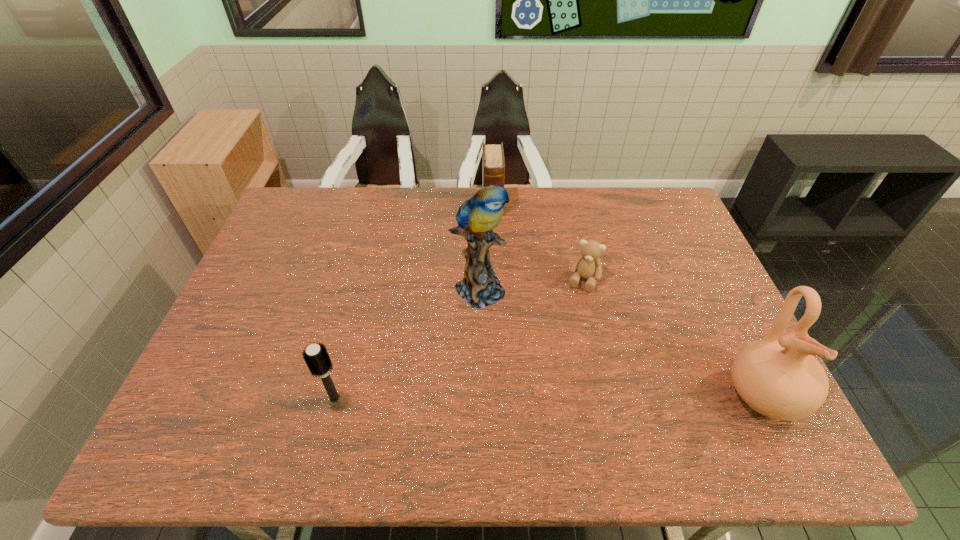
This screenshot has width=960, height=540. I want to click on object located in the right edge section of the desktop, so click(777, 376).

Where is `object that is at the near right corner`? object that is at the near right corner is located at coordinates (777, 376).

You are a GUI agent. You are given a task and a screenshot of the screen. Output one action in this format:
    pyautogui.click(x=<x>, y=<y>)
    Task: Click on the free location at the far edge of the desktop
    The image size is (960, 540).
    Given the screenshot: What is the action you would take?
    536,201

At what (x,y) coordinates should I click in order to perform the action: click on free space at the near edge. Please return your answer as a coordinate pair (x, y). The image size is (960, 540). Looking at the image, I should click on (615, 405).

In the image, there is a desktop. Find the location of `free space at the left edge`. free space at the left edge is located at coordinates pos(282,233).

At what (x,y) coordinates should I click in order to perform the action: click on free spot at the right edge of the desktop. Please return your answer as a coordinate pair (x, y). Looking at the image, I should click on (701, 260).

You are a GUI agent. You are given a task and a screenshot of the screen. Output one action in this format:
    pyautogui.click(x=<x>, y=<y>)
    Task: Click on the vacant space at the far left corner of the desktop
    
    Given the screenshot: What is the action you would take?
    pyautogui.click(x=307, y=213)

Find the location of a particular element. Image resolution: width=960 pixels, height=540 pixels. free space that is in between the pottery and the second object from right to left is located at coordinates (673, 338).

The width and height of the screenshot is (960, 540). Identify the location of free spot between the shortest object and the diary. (538, 242).

You are a GUI agent. You are given a task and a screenshot of the screen. Output one action in this format:
    pyautogui.click(x=<x>, y=<y>)
    Task: Click on the vacant space in between the pottery and the teddy bear
    This screenshot has width=960, height=540.
    Given the screenshot: What is the action you would take?
    pos(673,338)